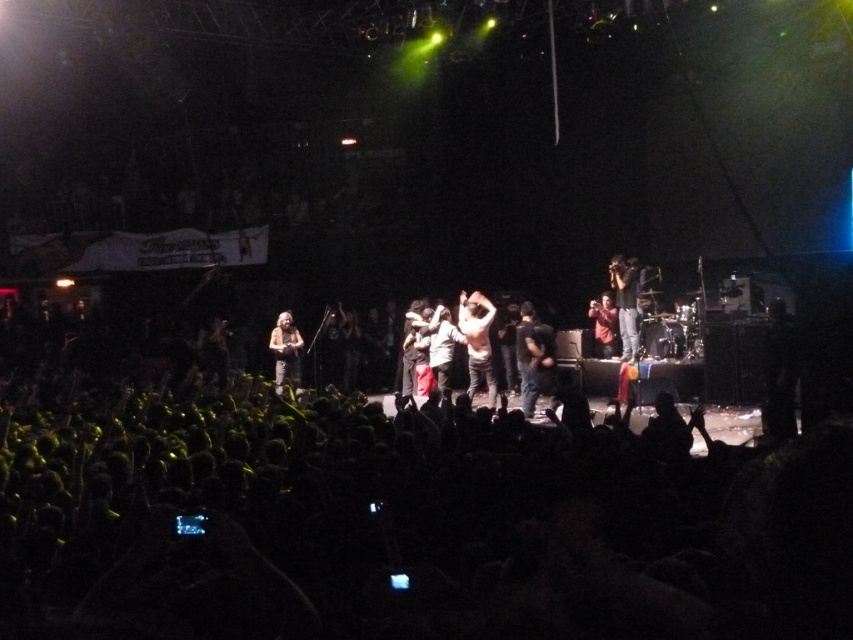
You are standing at the front row of the concert, and you want to take a photo of the point at coordinates point (535, 364). Your camera has a maximum focus range of 10 meters. Will your camera be able to focus on that point?

The distance of point (535, 364) from camera is 9.88 meters, so yes, the camera can focus on that point since it is within the maximum focus range of 10 meters.

You are at a concert and want to take a photo of the stage. There are two points of interest marked on your camera screen. The first is at point (534, 352), and the second is at point (619, 300). Which point is closer to your camera lens?

Point (534, 352) is closer to the camera lens than point (619, 300).